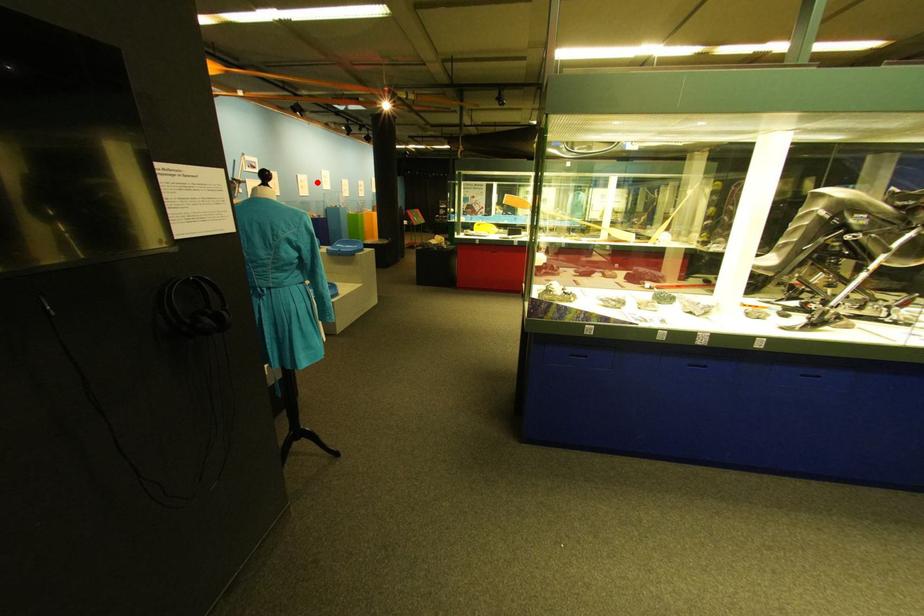
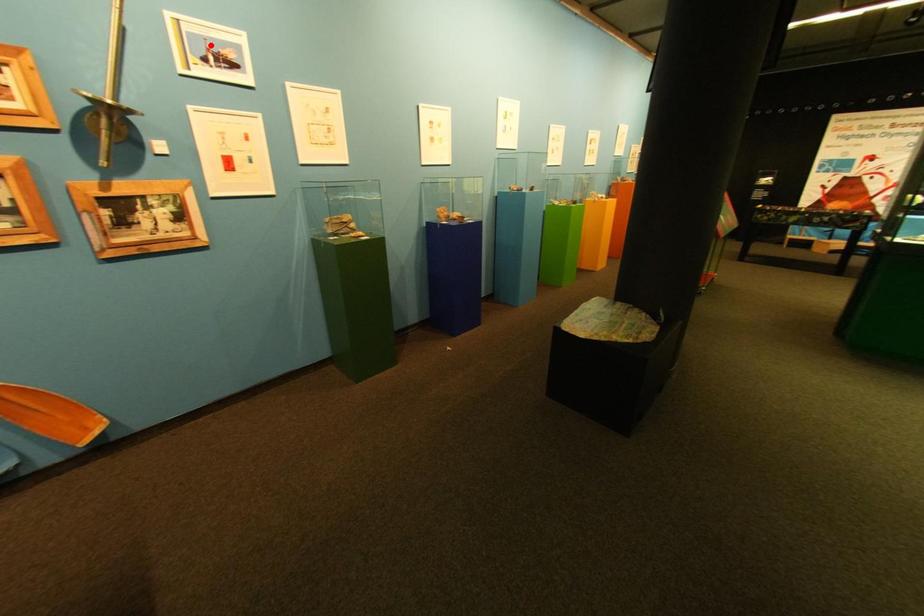
I am providing you with two images of the same scene from different viewpoints. A red point is marked on the first image and another point is marked on the second image. Do the highlighted points in image1 and image2 indicate the same real-world spot?

No